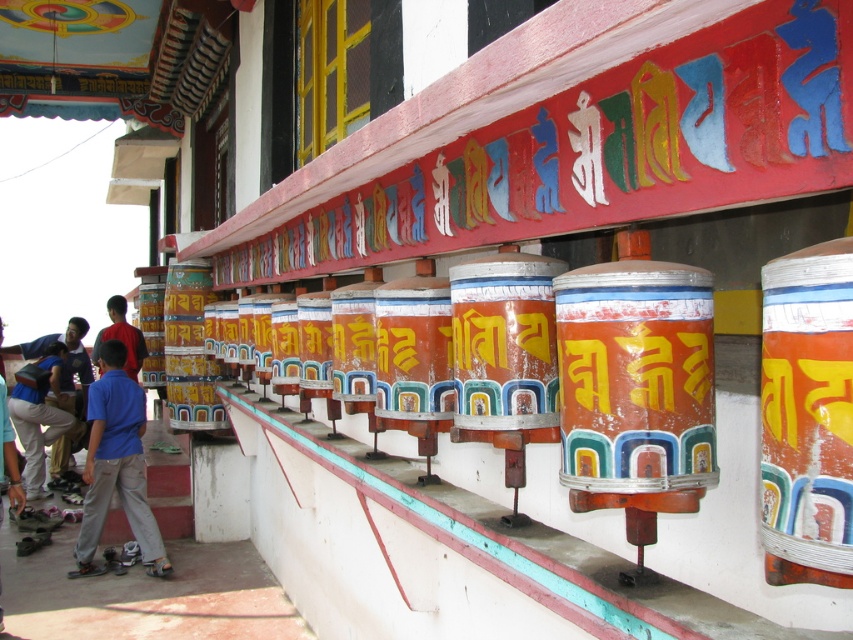
You are a photographer aiming to capture the prayer wheels on the wall. You notice a person wearing a blue fabric shirt at lower left and blue denim jeans at lower left. Which clothing item is wider when viewed from your position?

The blue fabric shirt at lower left is wider than the blue denim jeans at lower left according to the description.

You are a tourist standing 2 meters tall and want to touch the blue fabric shirt at lower left. If you extend your arm fully, which reaches 1.5 meters, can you reach it?

The blue fabric shirt at lower left is 7.65 meters away from you. Since your total reach is 3.5 meters, you cannot reach it.

You are a photographer trying to capture the prayer wheels on the wall. You notice two items in the foreground at the lower left corner of your viewfinder. One is labeled as the blue fabric shirt at lower left and the other is the blue shirt at lower left. Which of these two items is bigger in size?

The blue fabric shirt at lower left is larger in size than the blue shirt at lower left.